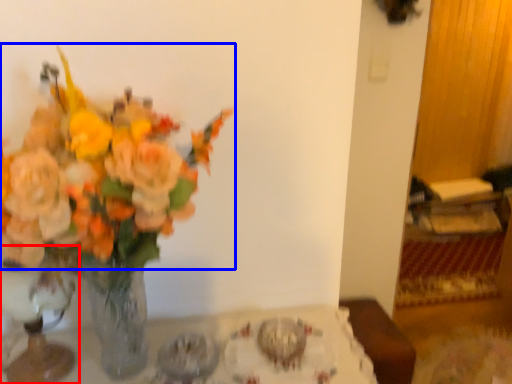
Question: Which object is closer to the camera taking this photo, vase (highlighted by a red box) or flower (highlighted by a blue box)?

Choices:
 (A) vase
 (B) flower

Answer: (B)